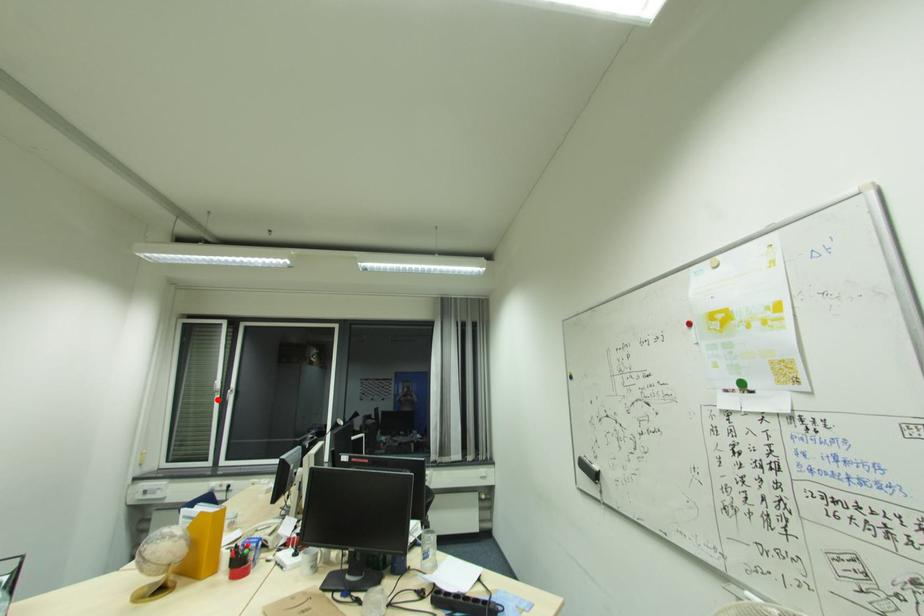
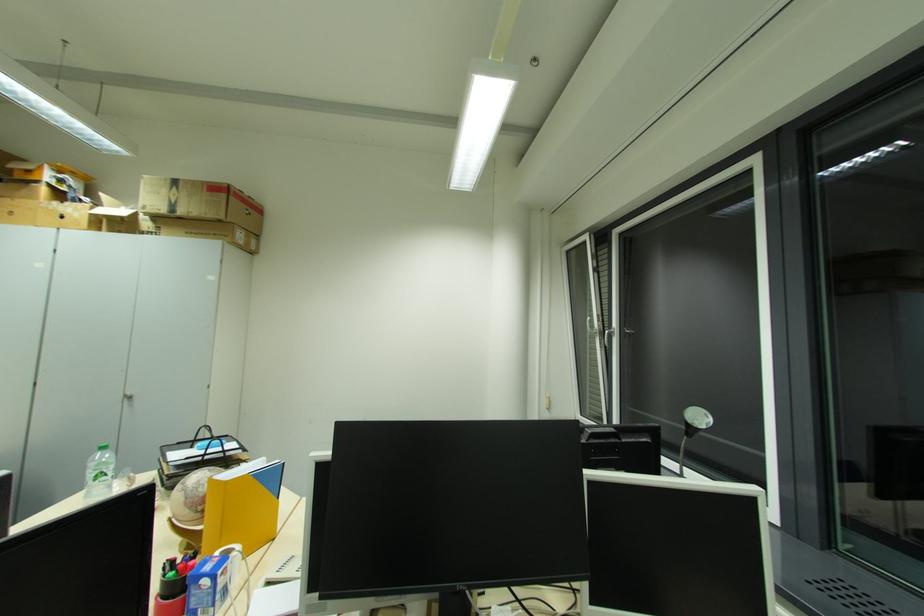
Find the pixel in the second image that matches the highlighted location in the first image.

(600, 342)